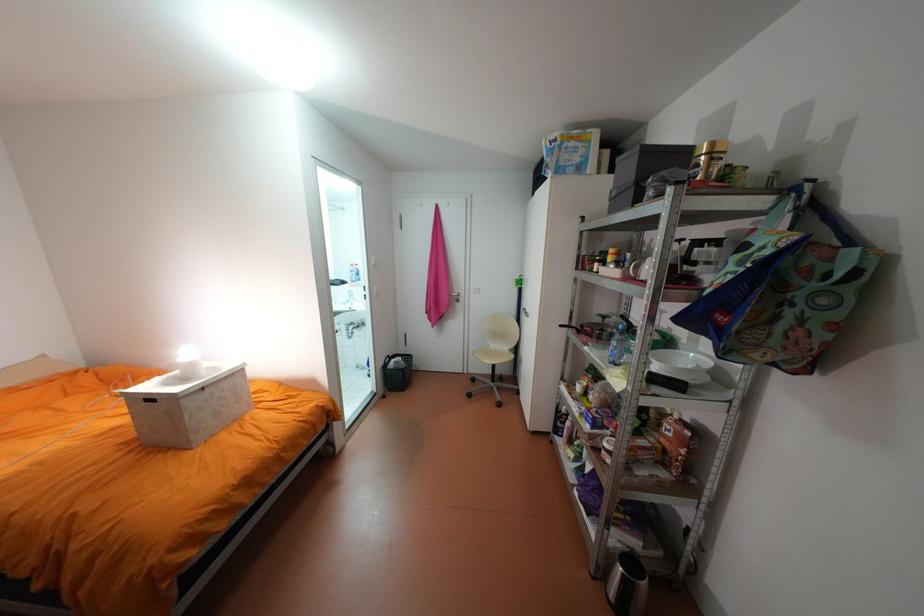
Find where to sit the white chair sitting surface. Please return your answer as a coordinate pair (x, y).

(492, 355)